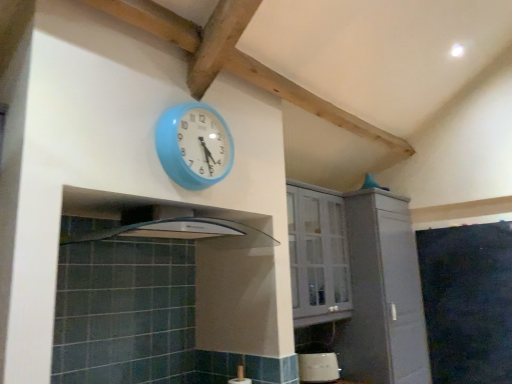
Question: Is white glossy toaster at lower center bigger or smaller than white glossy cabinet at upper center, which is counted as the 2th cabinetry, starting from the right?

Choices:
 (A) big
 (B) small

Answer: (B)

Question: From the image's perspective, is white glossy toaster at lower center positioned above or below white glossy cabinet at upper center, which is counted as the 2th cabinetry, starting from the right?

Choices:
 (A) below
 (B) above

Answer: (A)

Question: Estimate the real-world distances between objects in this image. Which object is farther from the white matte cabinet at center, which is the first cabinetry in right-to-left order?

Choices:
 (A) white glossy cabinet at upper center, which is counted as the 2th cabinetry, starting from the right
 (B) blue plastic wall clock at upper center
 (C) white glossy toaster at lower center
 (D) black matte chalkboard at right

Answer: (B)

Question: Which is farther from the blue plastic wall clock at upper center?

Choices:
 (A) white matte cabinet at center, which is counted as the 2th cabinetry, starting from the left
 (B) black matte chalkboard at right
 (C) white glossy toaster at lower center
 (D) white glossy cabinet at upper center, which is counted as the 2th cabinetry, starting from the right

Answer: (B)